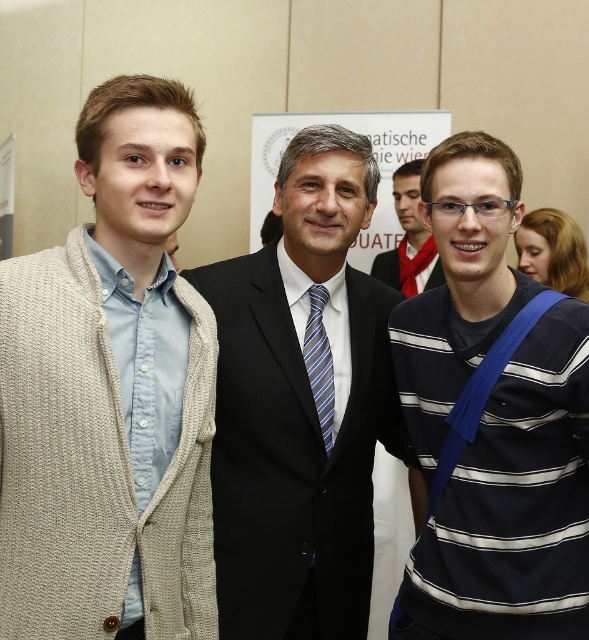
Can you confirm if beige knitted cardigan at left is shorter than blue striped tie at center?

No, beige knitted cardigan at left is not shorter than blue striped tie at center.

Is beige knitted cardigan at left taller than blue striped tie at center?

Yes.

Image resolution: width=589 pixels, height=640 pixels. I want to click on beige knitted cardigan at left, so click(x=110, y=392).

Between striped cotton sweater at center and blue striped tie at center, which one has less height?

Standing shorter between the two is blue striped tie at center.

Between point (425, 349) and point (316, 291), which one is positioned behind?

Positioned behind is point (316, 291).

Where is `striped cotton sweater at center`? striped cotton sweater at center is located at coordinates (491, 419).

Does black suit at center come behind blue striped tie at center?

No.

Does black suit at center have a greater height compared to blue striped tie at center?

Correct, black suit at center is much taller as blue striped tie at center.

Is point (297, 605) farther from camera compared to point (309, 291)?

That is False.

This screenshot has width=589, height=640. I want to click on black suit at center, so click(x=302, y=403).